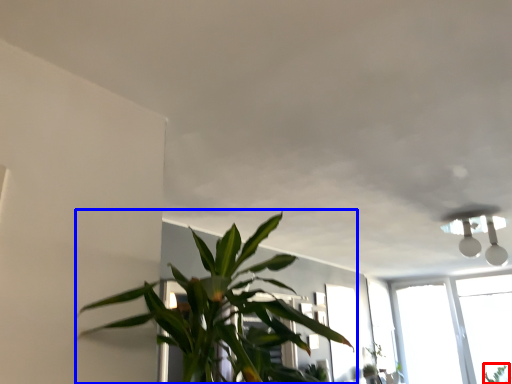
Question: Which point is further to the camera, plant (highlighted by a red box) or houseplant (highlighted by a blue box)?

Choices:
 (A) plant
 (B) houseplant

Answer: (A)